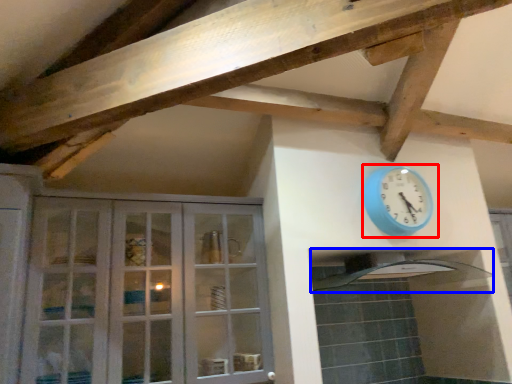
Question: Among these objects, which one is farthest to the camera, wall clock (highlighted by a red box) or exhaust hood (highlighted by a blue box)?

Choices:
 (A) wall clock
 (B) exhaust hood

Answer: (A)